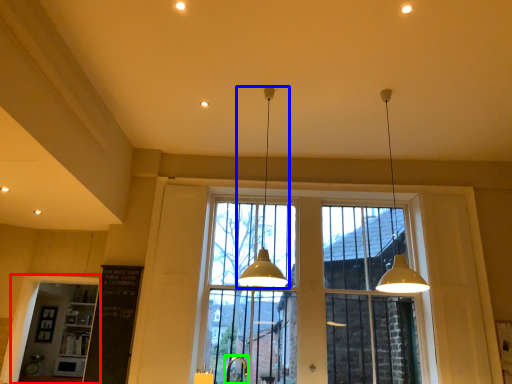
Question: Which object is the closest to the window frame (highlighted by a red box)? Choose among these: lamp (highlighted by a blue box) or faucet (highlighted by a green box).

Choices:
 (A) lamp
 (B) faucet

Answer: (B)